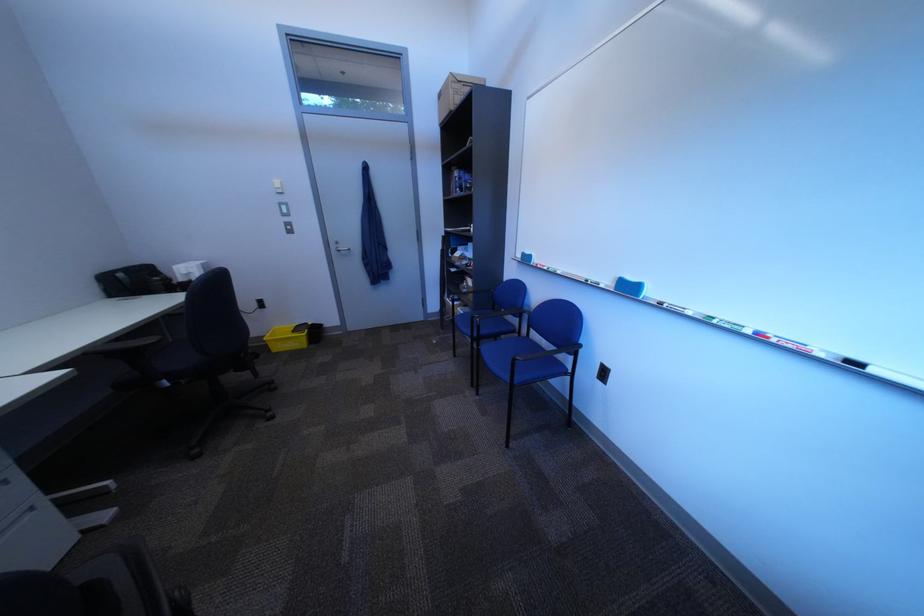
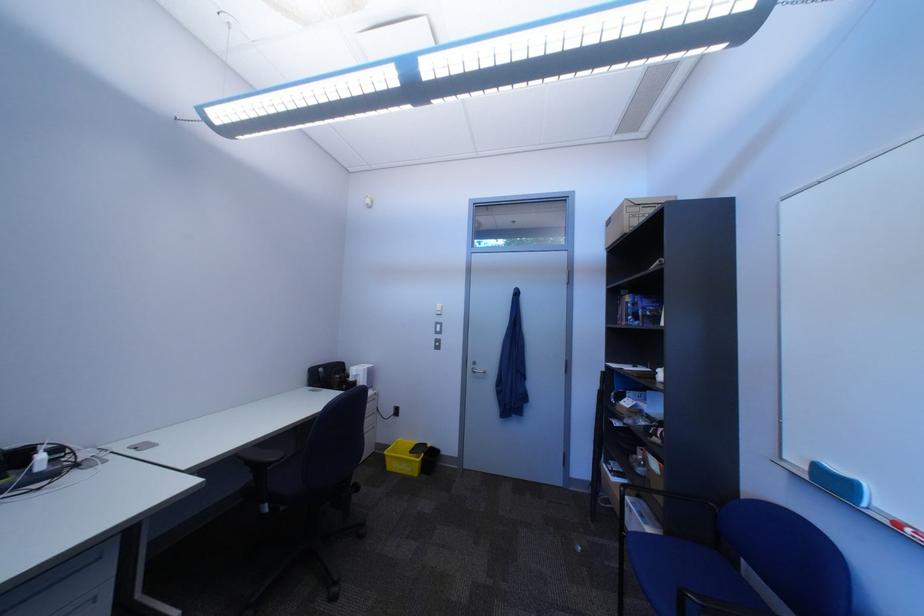
The point at (539, 256) is marked in the first image. Where is the corresponding point in the second image?

(833, 468)